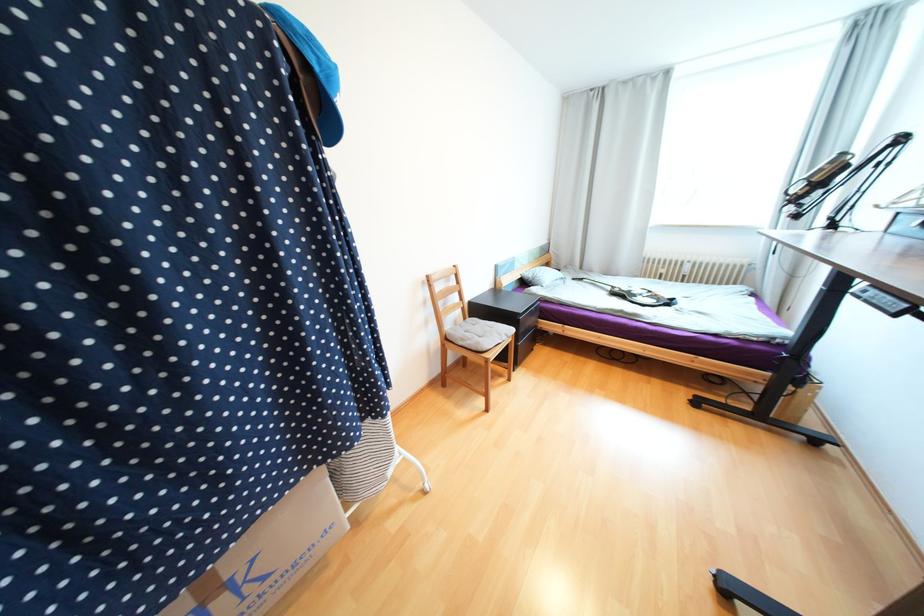
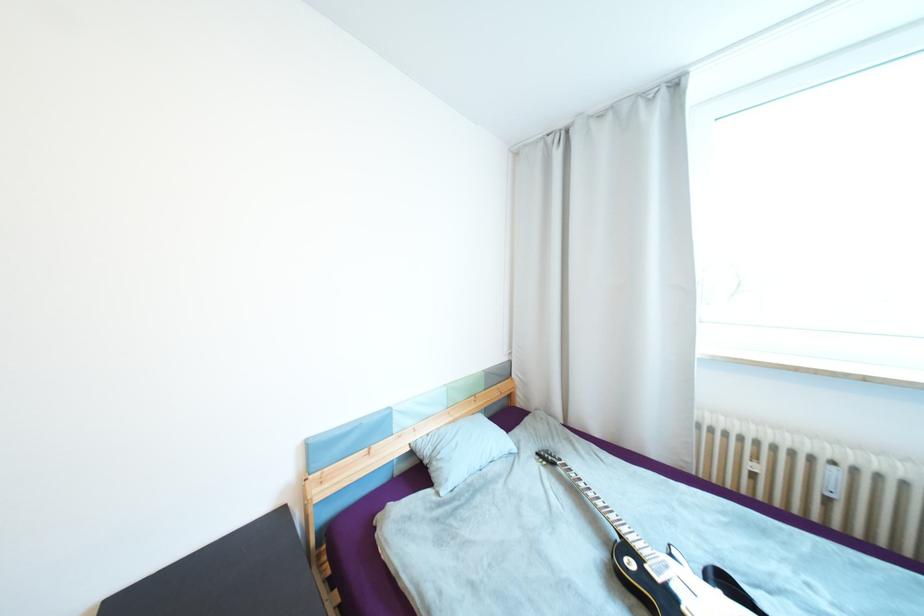
In a continuous first-person perspective shot, in which direction is the camera moving?

The movement direction of the cameraman is right, forward.